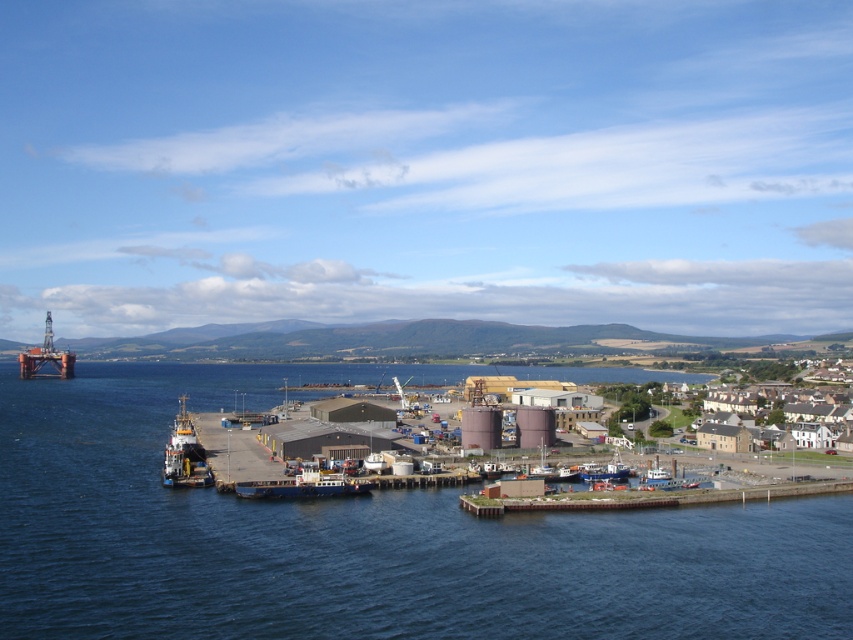
You are a harbor worker who needs to guide a new boat to dock. You see the blue matte ship at center and the white plastic boat at lower right. Which boat is positioned lower in the image?

The blue matte ship at center is positioned below the white plastic boat at lower right, so it is lower in the image.

A ship needs to dock at the brown concrete dock at lower right. The ship is 100 meters long. Will the ship fit if it docks there?

The ship is 100 meters long and the brown concrete dock at lower right is 114.45 meters long, so the ship will fit comfortably.

Based on the photo, you are standing at the center of the harbor and want to reach the brown concrete dock at lower right. According to the coordinates provided, in which direction should you walk to reach it?

The brown concrete dock at lower right is located at coordinates point (647, 499), so you should walk towards the lower right direction to reach it.